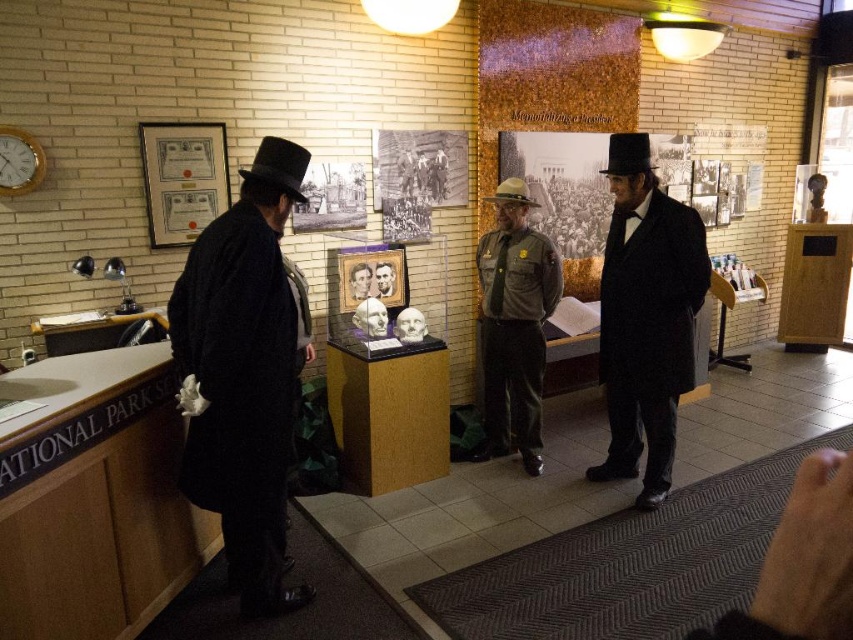
From the picture: Does matte black coat at left have a greater width compared to brown felt dress hat at center?

Yes, matte black coat at left is wider than brown felt dress hat at center.

Is point (230, 362) positioned behind point (509, 188)?

No, (230, 362) is in front of (509, 188).

Identify the location of matte black coat at left. (242, 376).

Does brown felt dress hat at center come in front of smooth beige bust at center?

Yes, it is in front of smooth beige bust at center.

Is brown felt dress hat at center above smooth beige bust at center?

Correct, brown felt dress hat at center is located above smooth beige bust at center.

Describe the element at coordinates (512, 193) in the screenshot. I see `brown felt dress hat at center` at that location.

Locate an element on the screen. The image size is (853, 640). brown felt dress hat at center is located at coordinates (512, 193).

Is brown uniform at center above black felt dress hat at left?

Incorrect, brown uniform at center is not positioned above black felt dress hat at left.

From the picture: Who is more forward, (531, 236) or (274, 177)?

Point (274, 177)

Locate an element on the screen. brown uniform at center is located at coordinates (514, 324).